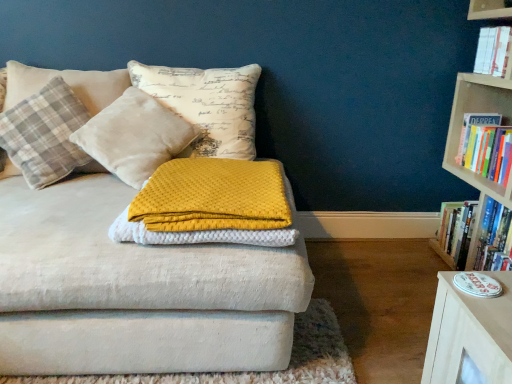
Question: From the image's perspective, is plaid fabric pillow at left, which is the first pillow from left to right, under white paper book at upper right, the first book from the top?

Choices:
 (A) yes
 (B) no

Answer: (A)

Question: Considering the relative sizes of plaid fabric pillow at left, which is the first pillow from left to right, and white paper book at upper right, the first book from the top, in the image provided, is plaid fabric pillow at left, which is the first pillow from left to right, bigger than white paper book at upper right, the first book from the top,?

Choices:
 (A) no
 (B) yes

Answer: (B)

Question: From a real-world perspective, is plaid fabric pillow at left, which appears as the second pillow when viewed from the right, on white paper book at upper right, the third book positioned from the bottom?

Choices:
 (A) yes
 (B) no

Answer: (B)

Question: Is plaid fabric pillow at left, which is the first pillow from left to right, to the right of white paper book at upper right, the first book from the top, from the viewer's perspective?

Choices:
 (A) no
 (B) yes

Answer: (A)

Question: Considering the relative sizes of plaid fabric pillow at left, which appears as the second pillow when viewed from the right, and white paper book at upper right, the first book from the top, in the image provided, is plaid fabric pillow at left, which appears as the second pillow when viewed from the right, shorter than white paper book at upper right, the first book from the top,?

Choices:
 (A) no
 (B) yes

Answer: (A)

Question: Is velvet cushion at upper left, which is the 2th pillow from left to right, in front of or behind wooden bookcase at right in the image?

Choices:
 (A) behind
 (B) front

Answer: (A)

Question: Is point (124, 127) positioned closer to the camera than point (499, 8)?

Choices:
 (A) closer
 (B) farther

Answer: (A)

Question: Is velvet cushion at upper left, the 1th pillow positioned from the right, spatially inside wooden bookcase at right, or outside of it?

Choices:
 (A) outside
 (B) inside

Answer: (A)

Question: From the image's perspective, is velvet cushion at upper left, the 1th pillow positioned from the right, above or below wooden bookcase at right?

Choices:
 (A) below
 (B) above

Answer: (B)

Question: Is point (495, 54) closer or farther from the camera than point (437, 249)?

Choices:
 (A) closer
 (B) farther

Answer: (A)

Question: Is white paper book at upper right, the third book positioned from the bottom, situated inside hardcover book at right, which appears as the 1th book when ordered from the bottom, or outside?

Choices:
 (A) outside
 (B) inside

Answer: (A)

Question: In terms of size, does white paper book at upper right, the first book from the top, appear bigger or smaller than hardcover book at right, which appears as the 1th book when ordered from the bottom?

Choices:
 (A) big
 (B) small

Answer: (B)

Question: From the image's perspective, is white paper book at upper right, the third book positioned from the bottom, located above or below hardcover book at right, placed as the third book when sorted from top to bottom?

Choices:
 (A) below
 (B) above

Answer: (B)

Question: Is point (30, 114) positioned closer to the camera than point (471, 132)?

Choices:
 (A) closer
 (B) farther

Answer: (A)

Question: Is plaid fabric pillow at left, which appears as the second pillow when viewed from the right, taller or shorter than hardcover book at right, marked as the 2th book in a top-to-bottom arrangement?

Choices:
 (A) tall
 (B) short

Answer: (A)